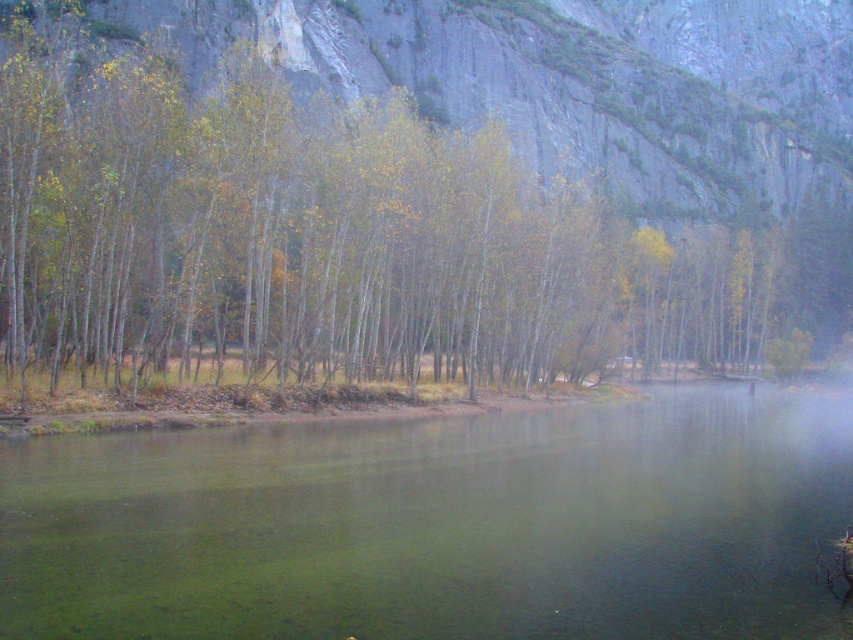
Question: Which object appears closest to the camera in this image?

Choices:
 (A) green translucent water at center
 (B) green matte trees at center

Answer: (A)

Question: Does green matte trees at center have a greater width compared to green translucent water at center?

Choices:
 (A) yes
 (B) no

Answer: (A)

Question: Which object appears closest to the camera in this image?

Choices:
 (A) green matte trees at center
 (B) green translucent water at center

Answer: (B)

Question: Which point appears farthest from the camera in this image?

Choices:
 (A) (341, 301)
 (B) (65, 541)

Answer: (A)

Question: Can you confirm if green matte trees at center is positioned above green translucent water at center?

Choices:
 (A) yes
 (B) no

Answer: (A)

Question: Does green matte trees at center have a smaller size compared to green translucent water at center?

Choices:
 (A) no
 (B) yes

Answer: (A)